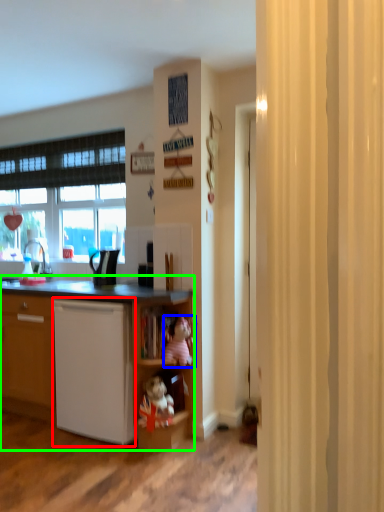
Question: Which object is the farthest from dish washer (highlighted by a red box)? Choose among these: toy (highlighted by a blue box) or cupboard (highlighted by a green box).

Choices:
 (A) toy
 (B) cupboard

Answer: (A)